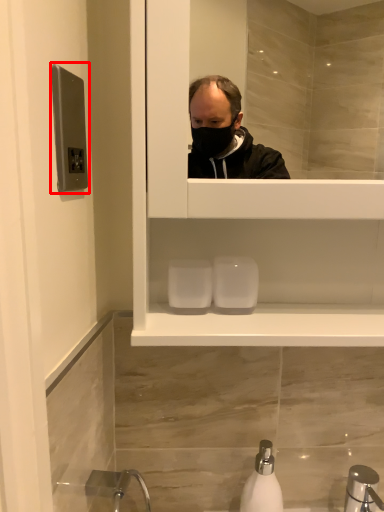
Question: From the image's perspective, what is the correct spatial relationship of door handle (annotated by the red box) in relation to soap dispenser?

Choices:
 (A) below
 (B) above

Answer: (B)